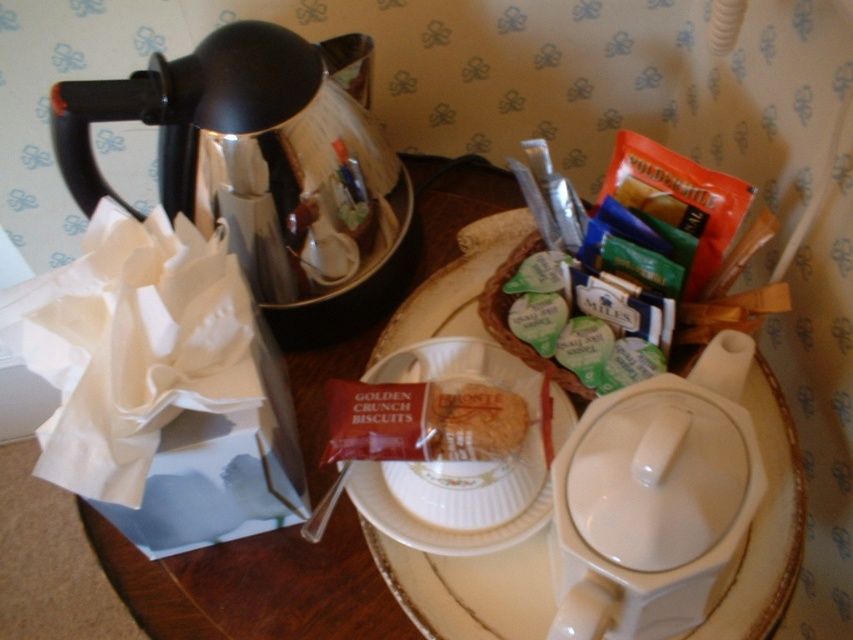
Which of these two, shiny metallic coffee pot at left or white ceramic table at center, stands shorter?

shiny metallic coffee pot at left is shorter.

Is shiny metallic coffee pot at left to the right of white ceramic table at center from the viewer's perspective?

No, shiny metallic coffee pot at left is not to the right of white ceramic table at center.

Which is in front, point (312, 186) or point (196, 577)?

Point (312, 186) is more forward.

Locate an element on the screen. The width and height of the screenshot is (853, 640). shiny metallic coffee pot at left is located at coordinates (254, 150).

Who is more distant from viewer, (305, 250) or (402, 454)?

Positioned behind is point (305, 250).

Is shiny metallic coffee pot at left shorter than metallic spoon at lower center?

No, shiny metallic coffee pot at left is not shorter than metallic spoon at lower center.

Between point (131, 76) and point (384, 426), which one is positioned behind?

The point (131, 76) is behind.

Locate an element on the screen. The image size is (853, 640). shiny metallic coffee pot at left is located at coordinates (254, 150).

Does point (453, 252) lie in front of point (498, 444)?

No, it is behind (498, 444).

Is point (260, 600) farther from viewer compared to point (511, 445)?

That is True.

Image resolution: width=853 pixels, height=640 pixels. I want to click on white ceramic table at center, so click(254, 586).